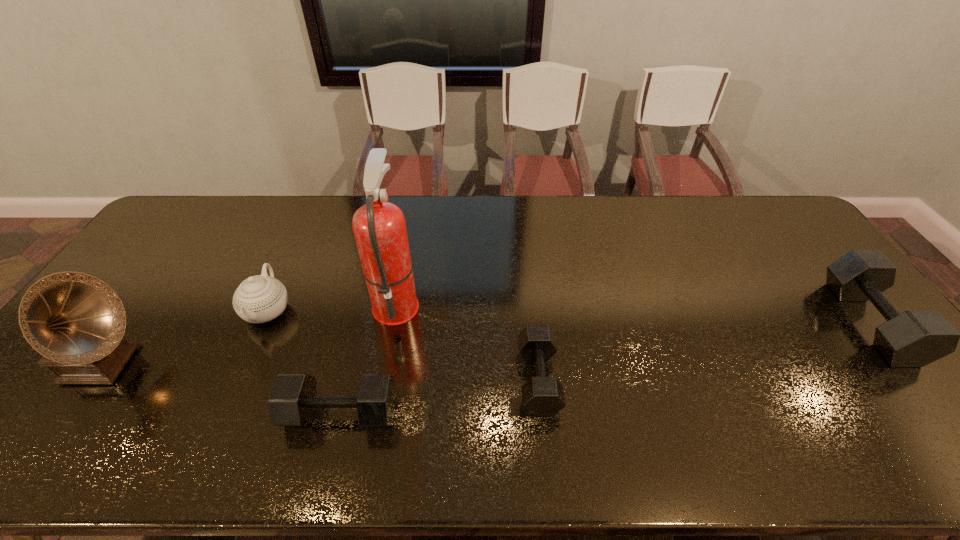
The width and height of the screenshot is (960, 540). Identify the location of blank space at the far edge. coord(468,213).

You are a GUI agent. You are given a task and a screenshot of the screen. Output one action in this format:
    pyautogui.click(x=<x>, y=<y>)
    Task: Click on the free space at the near edge
    The image size is (960, 540).
    Given the screenshot: What is the action you would take?
    pyautogui.click(x=855, y=418)

The image size is (960, 540). What are the coordinates of `vacant area at the far right corner` in the screenshot? It's located at (746, 207).

At what (x,y) coordinates should I click in order to perform the action: click on free space between the rightmost dumbbell and the leftmost dumbbell. Please return your answer as a coordinate pair (x, y). The image size is (960, 540). Looking at the image, I should click on (606, 367).

Where is `unoccupied area between the chinaware and the shortest object`? unoccupied area between the chinaware and the shortest object is located at coordinates (403, 345).

Where is `vacant space that is in between the fifth shortest object and the tallest object`? This screenshot has height=540, width=960. vacant space that is in between the fifth shortest object and the tallest object is located at coordinates (249, 334).

Locate an element on the screen. The width and height of the screenshot is (960, 540). vacant area that lies between the leftmost object and the fifth object from left to right is located at coordinates (320, 372).

This screenshot has width=960, height=540. What are the coordinates of `empty location between the phonograph record and the shortest dumbbell` in the screenshot? It's located at (320, 372).

The height and width of the screenshot is (540, 960). Find the location of `free space between the second shortest object and the second object from left to right`. free space between the second shortest object and the second object from left to right is located at coordinates (304, 362).

Where is `vacant area that lies between the shortest object and the fire extinguisher`? This screenshot has width=960, height=540. vacant area that lies between the shortest object and the fire extinguisher is located at coordinates (468, 341).